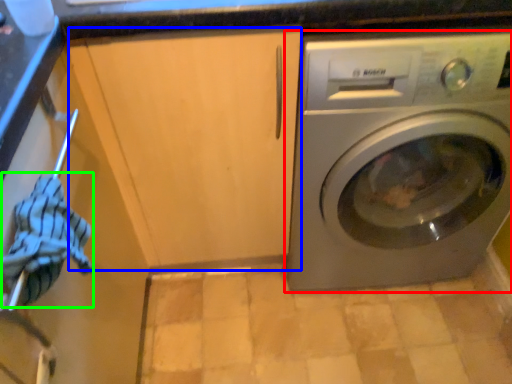
Question: Estimate the real-world distances between objects in this image. Which object is closer to washing machine (highlighted by a red box), cabinetry (highlighted by a blue box) or clothing (highlighted by a green box)?

Choices:
 (A) cabinetry
 (B) clothing

Answer: (A)